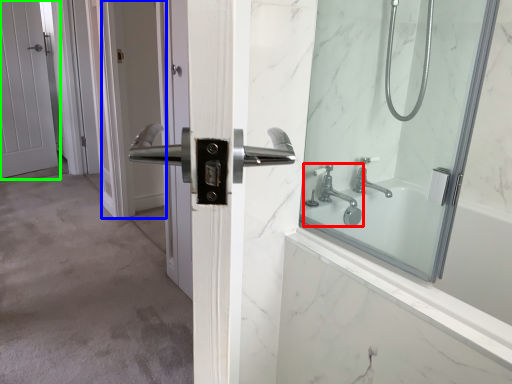
Question: Estimate the real-world distances between objects in this image. Which object is farther from tap (highlighted by a red box), screen door (highlighted by a blue box) or door (highlighted by a green box)?

Choices:
 (A) screen door
 (B) door

Answer: (B)